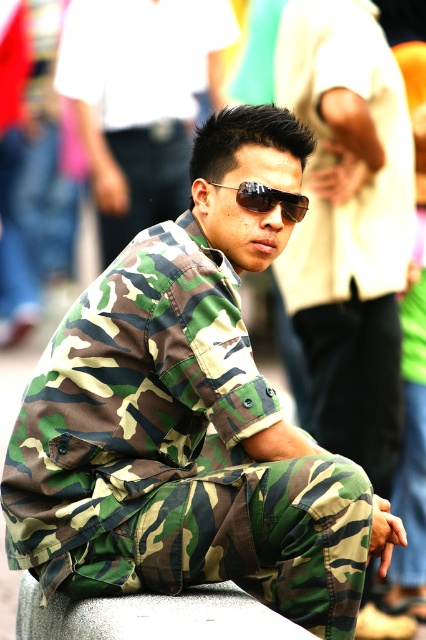
Question: Estimate the real-world distances between objects in this image. Which object is farther from the camo fabric uniform at center?

Choices:
 (A) camo fabric shirt at center
 (B) gray textured concrete at center
 (C) sunglasses at center

Answer: (A)

Question: In this image, where is camo fabric uniform at center located relative to camo fabric shirt at center?

Choices:
 (A) above
 (B) below

Answer: (B)

Question: Based on their relative distances, which object is farther from the camo fabric shirt at center?

Choices:
 (A) camo fabric uniform at center
 (B) sunglasses at center

Answer: (B)

Question: Which of the following is the farthest from the observer?

Choices:
 (A) (393, 188)
 (B) (249, 198)
 (C) (169, 28)
 (D) (85, 625)

Answer: (C)

Question: Is camo fabric uniform at center closer to the viewer compared to sunglasses at center?

Choices:
 (A) yes
 (B) no

Answer: (B)

Question: Does camo fabric shirt at center come in front of sunglasses at center?

Choices:
 (A) yes
 (B) no

Answer: (B)